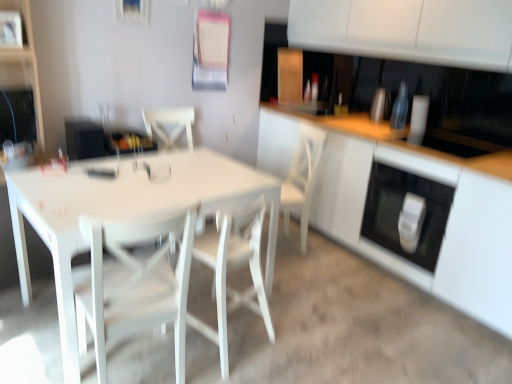
Question: Visually, is white wood chair at center, acting as the 2th chair starting from the left, positioned to the left or to the right of white wood chair at center?

Choices:
 (A) left
 (B) right

Answer: (A)

Question: Is point (226, 359) closer or farther from the camera than point (317, 127)?

Choices:
 (A) farther
 (B) closer

Answer: (B)

Question: Which is nearer to the white glossy soap dispenser at lower right?

Choices:
 (A) white glossy oven at lower right
 (B) white glossy cabinet at center
 (C) white glossy table at center
 (D) white matte chair at center, arranged as the first chair when viewed from the left
 (E) white wood chair at center

Answer: (A)

Question: Which object is the closest to the white glossy oven at lower right?

Choices:
 (A) white matte chair at center, arranged as the first chair when viewed from the left
 (B) white glossy soap dispenser at lower right
 (C) white glossy cabinet at center
 (D) white glossy table at center
 (E) white wood chair at center, the 1th chair from the right

Answer: (C)